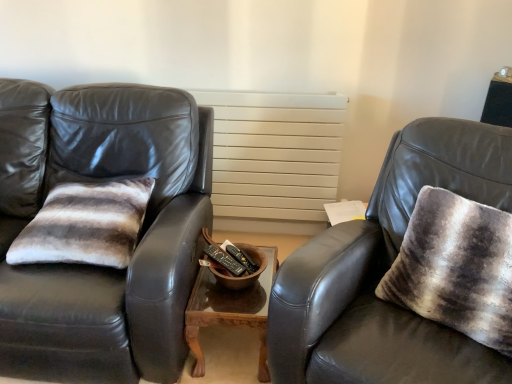
Question: From a real-world perspective, is white matte radiator at center above or below matte black leather couch at left?

Choices:
 (A) below
 (B) above

Answer: (B)

Question: Is white matte radiator at center in front of or behind matte black leather couch at left in the image?

Choices:
 (A) behind
 (B) front

Answer: (A)

Question: Estimate the real-world distances between objects in this image. Which object is farther from the textured gray throw pillow at right?

Choices:
 (A) matte black leather chair at right
 (B) white matte radiator at center
 (C) matte black leather couch at left
 (D) striped fur pillow at left
 (E) wooden table at center

Answer: (D)

Question: Which object is positioned farthest from the matte black leather chair at right?

Choices:
 (A) wooden table at center
 (B) white matte radiator at center
 (C) textured gray throw pillow at right
 (D) striped fur pillow at left
 (E) matte black leather couch at left

Answer: (B)